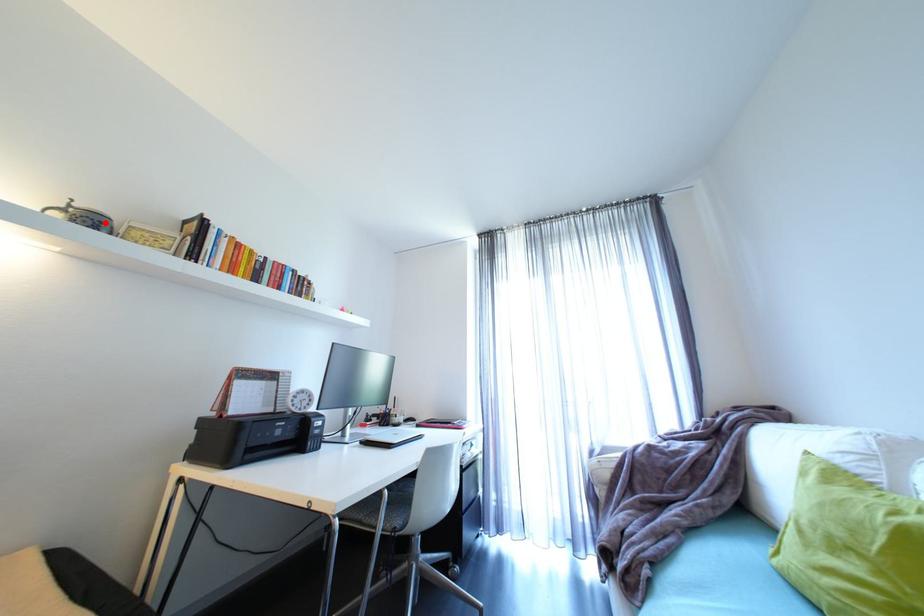
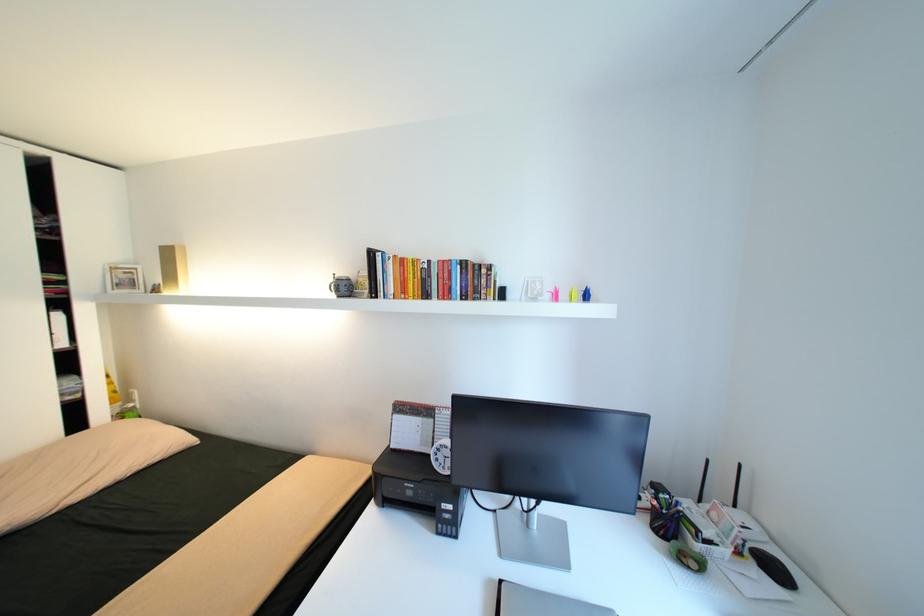
Question: I am providing you with two images of the same scene from different viewpoints. A red point is marked on the first image. Can you still see the location of the red point in image 2?

Choices:
 (A) Yes
 (B) No

Answer: (A)